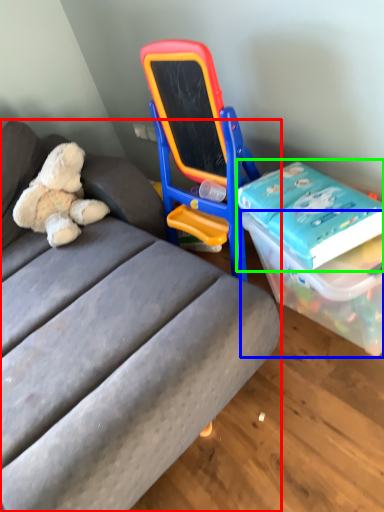
Question: Based on their relative distances, which object is farther from studio couch (highlighted by a red box)? Choose from box (highlighted by a blue box) and book (highlighted by a green box).

Choices:
 (A) box
 (B) book

Answer: (B)